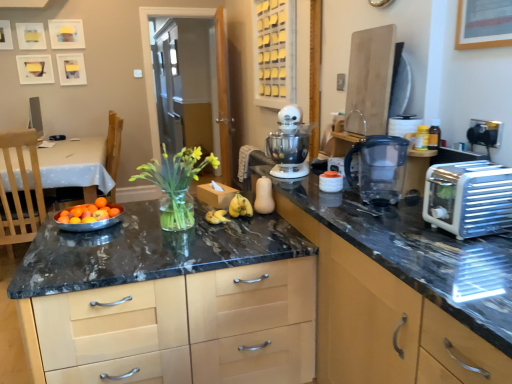
This screenshot has height=384, width=512. In order to click on free space in front of yellow matte bananas at center in this screenshot , I will do `click(234, 232)`.